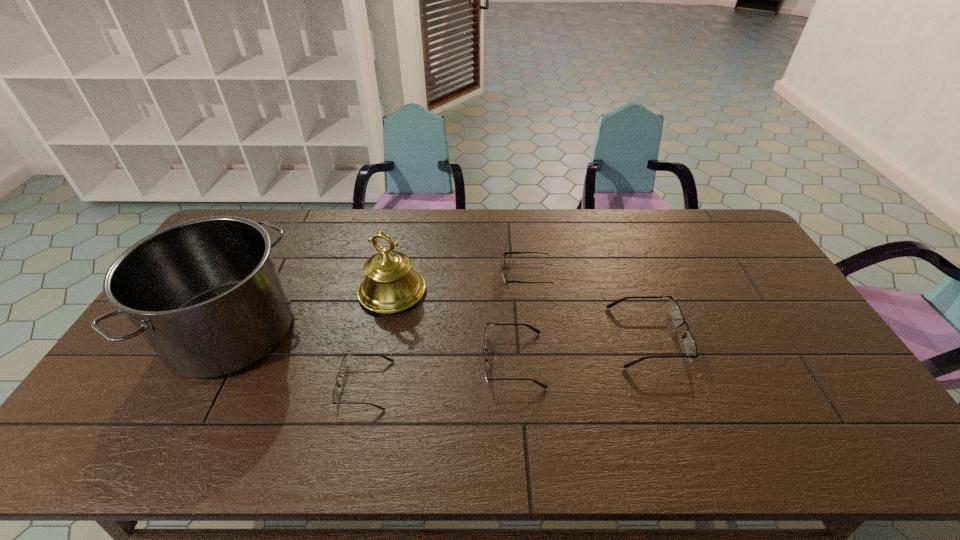
The width and height of the screenshot is (960, 540). In order to click on object present at the left edge in this screenshot , I will do `click(205, 293)`.

Image resolution: width=960 pixels, height=540 pixels. I want to click on object that is at the near left corner, so click(205, 293).

Find the location of a particular element. This screenshot has height=540, width=960. free region at the far edge of the desktop is located at coordinates (439, 244).

In order to click on free space at the far left corner of the desktop in this screenshot , I will do `click(260, 213)`.

I want to click on free space between the second spectacles from right to left and the shortest spectacles, so click(x=439, y=373).

I want to click on free area in between the second spectacles from left to right and the leftmost object, so click(x=372, y=345).

This screenshot has height=540, width=960. I want to click on free space between the bell and the saucepan, so click(312, 311).

This screenshot has height=540, width=960. Identify the location of free spot between the second shortest spectacles and the sunglasses. (519, 317).

In order to click on unoccupied area between the bell and the second spectacles from left to right in this screenshot , I will do `click(453, 326)`.

This screenshot has height=540, width=960. I want to click on free spot between the bell and the sunglasses, so click(458, 282).